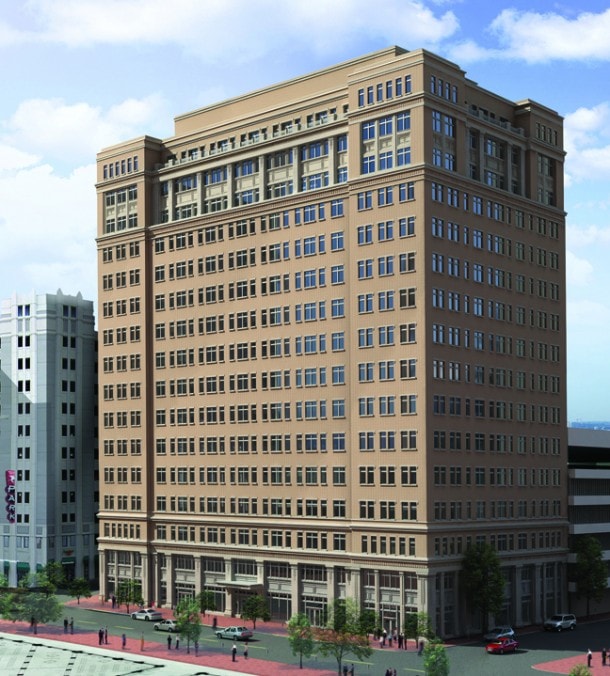
You are a GUI agent. You are given a task and a screenshot of the screen. Output one action in this format:
    pyautogui.click(x=<x>, y=<y>)
    Task: Click on the window
    This screenshot has width=610, height=676.
    Given the screenshot: What is the action you would take?
    pyautogui.click(x=361, y=368)